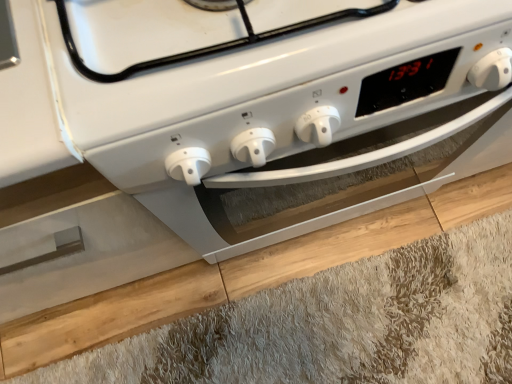
Question: Would you say white glossy oven at center contains light brown wood at lower center?

Choices:
 (A) yes
 (B) no

Answer: (B)

Question: From the image's perspective, would you say white glossy oven at center is positioned over light brown wood at lower center?

Choices:
 (A) yes
 (B) no

Answer: (A)

Question: Does white glossy oven at center appear on the left side of light brown wood at lower center?

Choices:
 (A) no
 (B) yes

Answer: (B)

Question: From a real-world perspective, is white glossy oven at center under light brown wood at lower center?

Choices:
 (A) yes
 (B) no

Answer: (B)

Question: Could you tell me if white glossy oven at center is facing light brown wood at lower center?

Choices:
 (A) no
 (B) yes

Answer: (A)

Question: Is the depth of white glossy oven at center less than that of light brown wood at lower center?

Choices:
 (A) no
 (B) yes

Answer: (B)

Question: Is light brown wood at lower center wider than white glossy oven at center?

Choices:
 (A) yes
 (B) no

Answer: (A)

Question: From a real-world perspective, is light brown wood at lower center physically below white glossy oven at center?

Choices:
 (A) yes
 (B) no

Answer: (A)

Question: Can you confirm if light brown wood at lower center is positioned to the left of white glossy oven at center?

Choices:
 (A) no
 (B) yes

Answer: (A)

Question: Is light brown wood at lower center surrounding white glossy oven at center?

Choices:
 (A) yes
 (B) no

Answer: (B)

Question: Would you say light brown wood at lower center is a long distance from white glossy oven at center?

Choices:
 (A) yes
 (B) no

Answer: (B)

Question: From the image's perspective, is light brown wood at lower center over white glossy oven at center?

Choices:
 (A) yes
 (B) no

Answer: (B)

Question: Considering the relative positions of light brown wood at lower center and white glossy oven at center in the image provided, is light brown wood at lower center to the left or to the right of white glossy oven at center?

Choices:
 (A) left
 (B) right

Answer: (B)